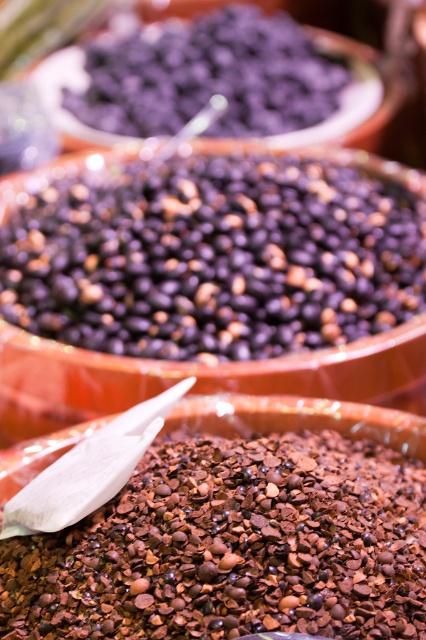
Between point (22, 314) and point (224, 38), which one is positioned behind?

Point (224, 38)

Is point (360, 273) farther from camera compared to point (216, 132)?

No.

The image size is (426, 640). Identify the location of dark matte beans at center. (215, 257).

Can you confirm if brown granular chocolate at center is positioned to the left of dark purple matte beans at upper center?

→ No, brown granular chocolate at center is not to the left of dark purple matte beans at upper center.

Does brown granular chocolate at center appear over dark purple matte beans at upper center?

Incorrect, brown granular chocolate at center is not positioned above dark purple matte beans at upper center.

Is point (287, 627) less distant than point (285, 112)?

Yes, point (287, 627) is in front of point (285, 112).

Where is `brown granular chocolate at center`? This screenshot has height=640, width=426. brown granular chocolate at center is located at coordinates (233, 547).

Who is higher up, dark matte beans at center or brown granular chocolate at center?

dark matte beans at center

Does dark matte beans at center have a greater width compared to brown granular chocolate at center?

Answer: Yes, dark matte beans at center is wider than brown granular chocolate at center.

Who is more distant from viewer, (402, 316) or (155, 515)?

Positioned behind is point (402, 316).

The image size is (426, 640). Identify the location of dark matte beans at center. (215, 257).